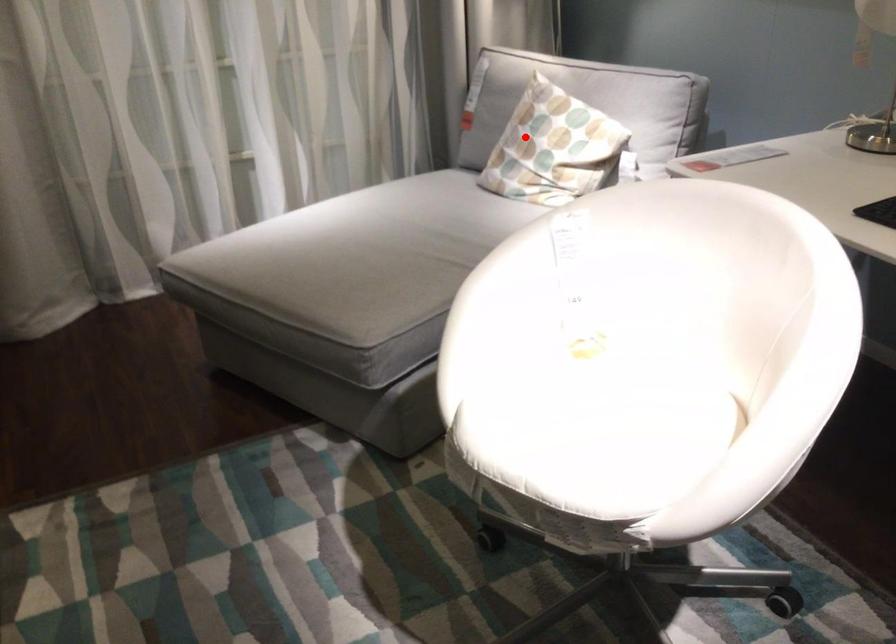
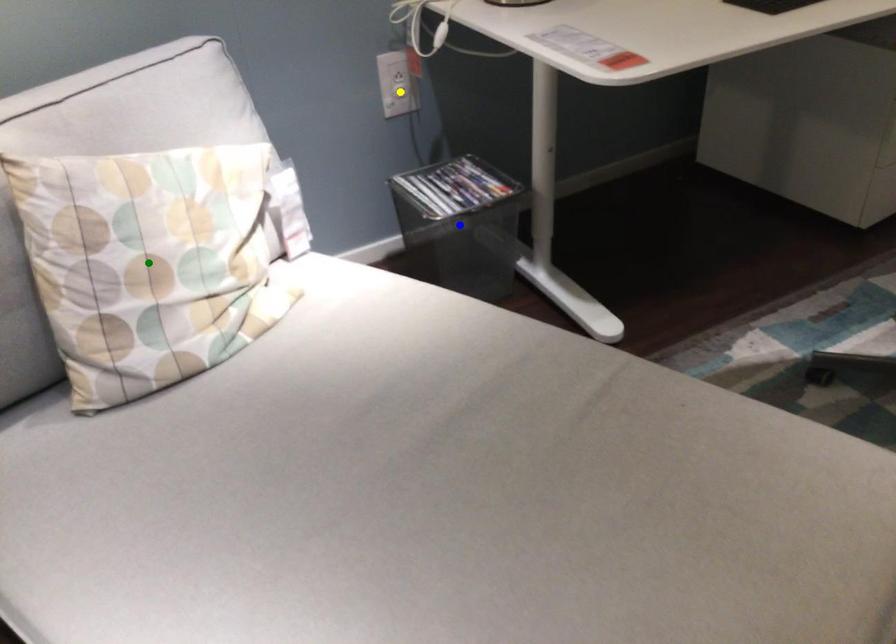
Question: I am providing you with two images of the same scene from different viewpoints. A red point is marked on the first image. You are given multiple points on the second image. In image 2, which mark is for the same physical point as the one in image 1?

Choices:
 (A) blue point
 (B) green point
 (C) yellow point

Answer: (B)